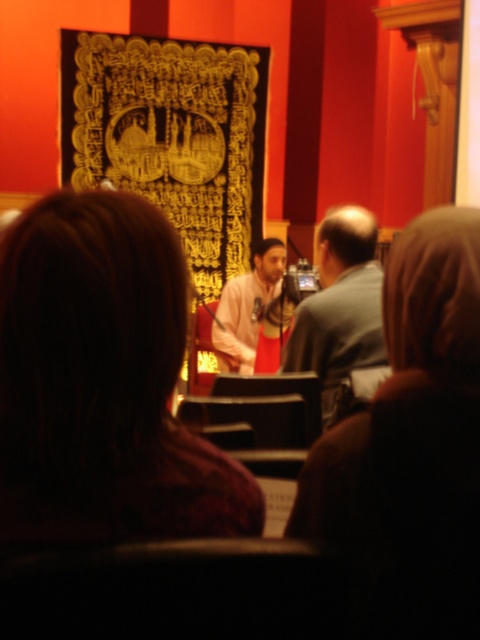
You are an event organizer who needs to ensure that all clothing items in the scene are appropriately sized for their wearers. Based on the image, which clothing item, the brown fabric headscarf at center or the gray fabric shirt at center, might be more likely to require adjustment due to its size?

The brown fabric headscarf at center is larger in size than the gray fabric shirt at center, so it might require adjustment due to its size.

You are an event coordinator observing the scene. You need to determine if the microphone is within reach of the dark brown hair at center and the gray fabric shirt at center. Can you confirm if the microphone is accessible to both?

The dark brown hair at center is shorter than gray fabric shirt at center, so the microphone is accessible to both the dark brown hair at center and the gray fabric shirt at center since the shirt is longer and can reach the microphone if needed.

You are an audience member sitting in the back row of the room. You notice two items at the center of the stage. One is dark brown hair at center and the other is gray fabric shirt at center. Which item is closer to you?

The dark brown hair at center is closer to you because it is in front of the gray fabric shirt at center.